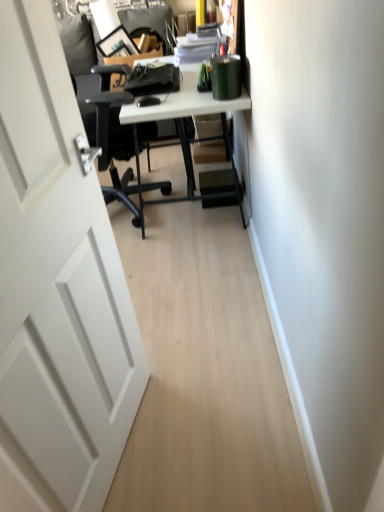
Where is `free space between white glossy desk at center and white matte door at left`? free space between white glossy desk at center and white matte door at left is located at coordinates (184, 292).